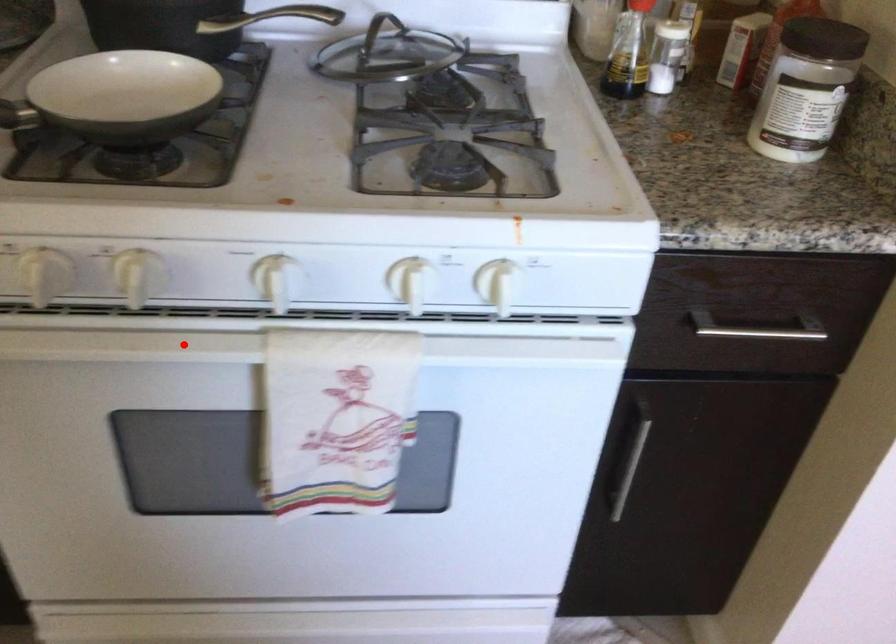
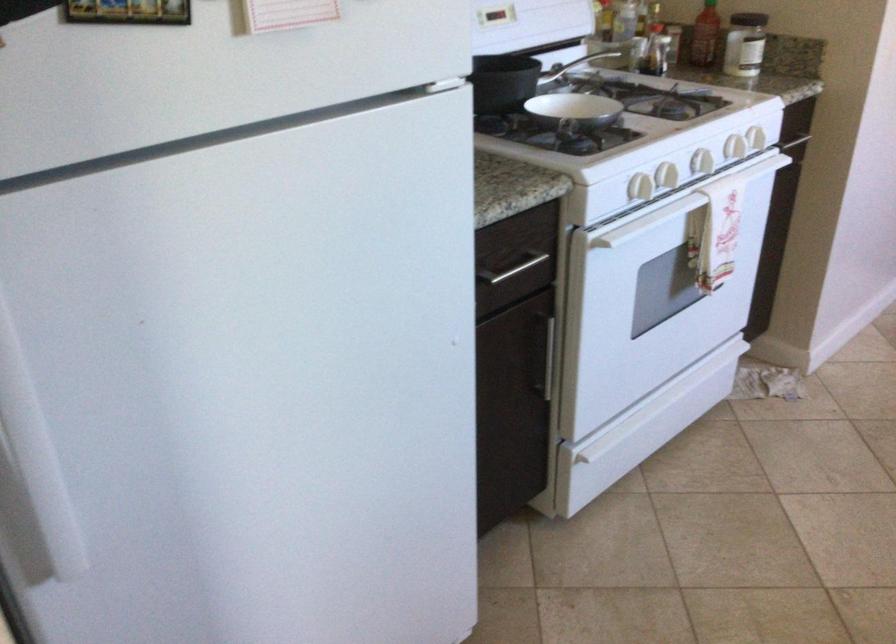
Question: I am providing you with two images of the same scene from different viewpoints. Image1 has a red point marked. In image2, the corresponding 3D location appears at what relative position? Reply with the corresponding letter.

Choices:
 (A) Closer
 (B) Farther

Answer: (B)